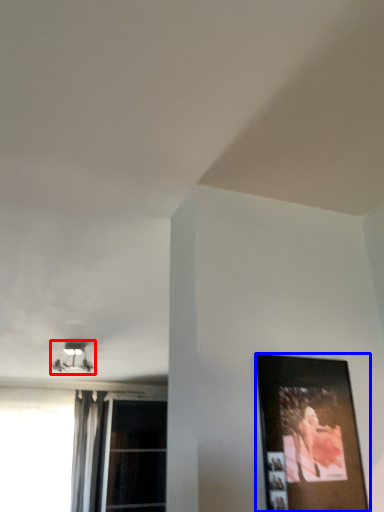
Question: Which object is closer to the camera taking this photo, lamp (highlighted by a red box) or picture frame (highlighted by a blue box)?

Choices:
 (A) lamp
 (B) picture frame

Answer: (B)